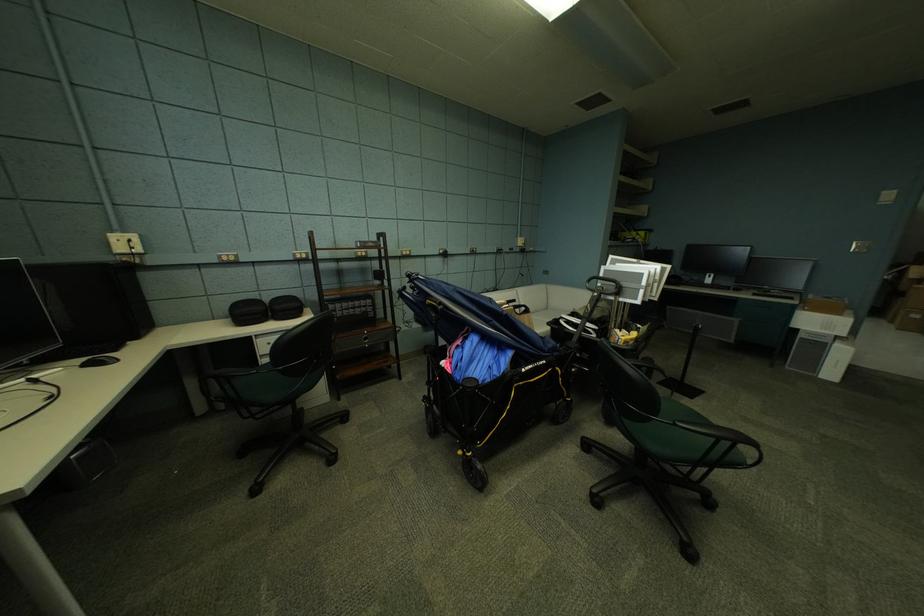
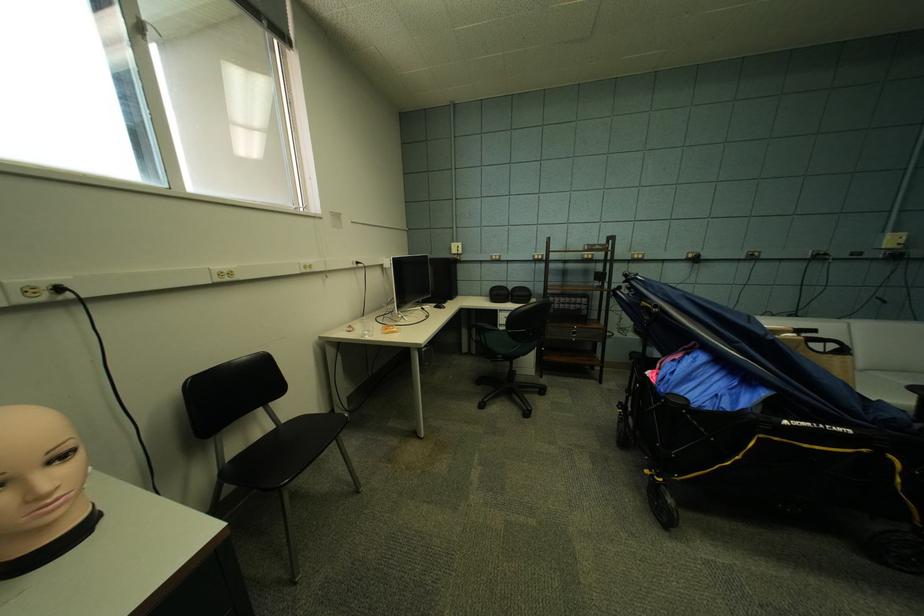
Where in the second image is the point corresponding to point 517,304 from the first image?

(808, 331)